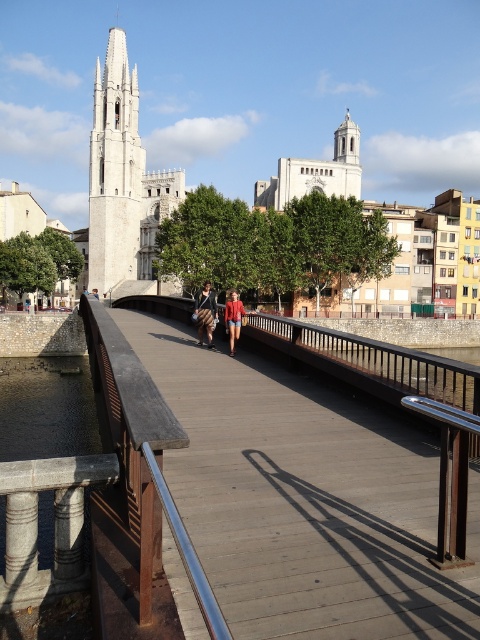
Question: Based on their relative distances, which object is farther from the wooden bridge at center?

Choices:
 (A) white stone tower at upper left
 (B) striped fabric skirt at center

Answer: (A)

Question: Which of these objects is positioned closest to the matte red shorts at center?

Choices:
 (A) wooden bridge at center
 (B) striped fabric skirt at center

Answer: (B)

Question: Among these points, which one is nearest to the camera?

Choices:
 (A) (240, 440)
 (B) (227, 321)

Answer: (A)

Question: Observing the image, what is the correct spatial positioning of wooden bridge at center in reference to striped fabric skirt at center?

Choices:
 (A) above
 (B) below

Answer: (B)

Question: Observing the image, what is the correct spatial positioning of wooden bridge at center in reference to white stone tower at upper left?

Choices:
 (A) below
 (B) above

Answer: (A)

Question: Is white stone tower at upper left positioned in front of striped fabric skirt at center?

Choices:
 (A) yes
 (B) no

Answer: (B)